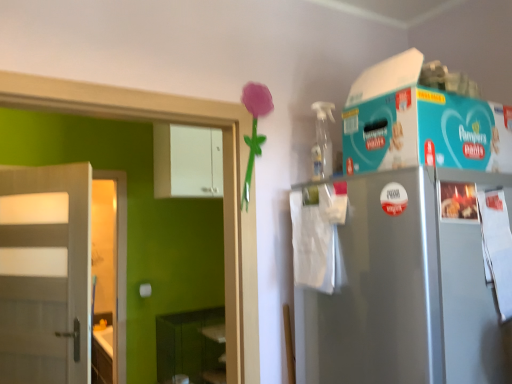
Question: Can you confirm if green matte shelf at lower left is bigger than white matte door at left?

Choices:
 (A) no
 (B) yes

Answer: (B)

Question: Is green matte shelf at lower left not near white matte door at left?

Choices:
 (A) yes
 (B) no

Answer: (A)

Question: Can you confirm if green matte shelf at lower left is thinner than white matte door at left?

Choices:
 (A) no
 (B) yes

Answer: (A)

Question: Could white matte door at left be considered to be inside green matte shelf at lower left?

Choices:
 (A) no
 (B) yes

Answer: (A)

Question: Is green matte shelf at lower left wider than white matte door at left?

Choices:
 (A) yes
 (B) no

Answer: (A)

Question: Considering the positions of green matte shelf at lower left and white glossy cabinet at upper center in the image, is green matte shelf at lower left bigger or smaller than white glossy cabinet at upper center?

Choices:
 (A) small
 (B) big

Answer: (B)

Question: Visually, is green matte shelf at lower left positioned to the left or to the right of white glossy cabinet at upper center?

Choices:
 (A) right
 (B) left

Answer: (A)

Question: From the image's perspective, is green matte shelf at lower left above or below white glossy cabinet at upper center?

Choices:
 (A) above
 (B) below

Answer: (B)

Question: From a real-world perspective, is green matte shelf at lower left positioned above or below white glossy cabinet at upper center?

Choices:
 (A) below
 (B) above

Answer: (A)

Question: Looking at their shapes, would you say green matte shelf at lower left is wider or thinner than white matte door at left?

Choices:
 (A) wide
 (B) thin

Answer: (A)

Question: Visually, is green matte shelf at lower left positioned to the left or to the right of white matte door at left?

Choices:
 (A) left
 (B) right

Answer: (B)

Question: From a real-world perspective, relative to white matte door at left, is green matte shelf at lower left vertically above or below?

Choices:
 (A) below
 (B) above

Answer: (A)

Question: Considering the positions of point pyautogui.click(x=214, y=355) and point pyautogui.click(x=62, y=236), is point pyautogui.click(x=214, y=355) closer or farther from the camera than point pyautogui.click(x=62, y=236)?

Choices:
 (A) farther
 (B) closer

Answer: (A)

Question: Is point (209, 178) closer or farther from the camera than point (166, 377)?

Choices:
 (A) farther
 (B) closer

Answer: (B)

Question: Considering the positions of white glossy cabinet at upper center and green matte shelf at lower left in the image, is white glossy cabinet at upper center wider or thinner than green matte shelf at lower left?

Choices:
 (A) thin
 (B) wide

Answer: (A)